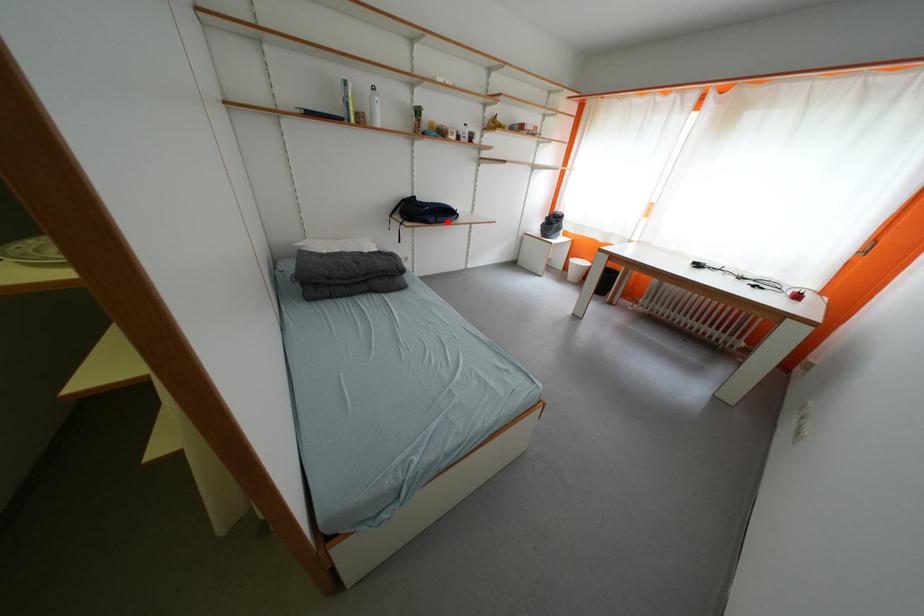
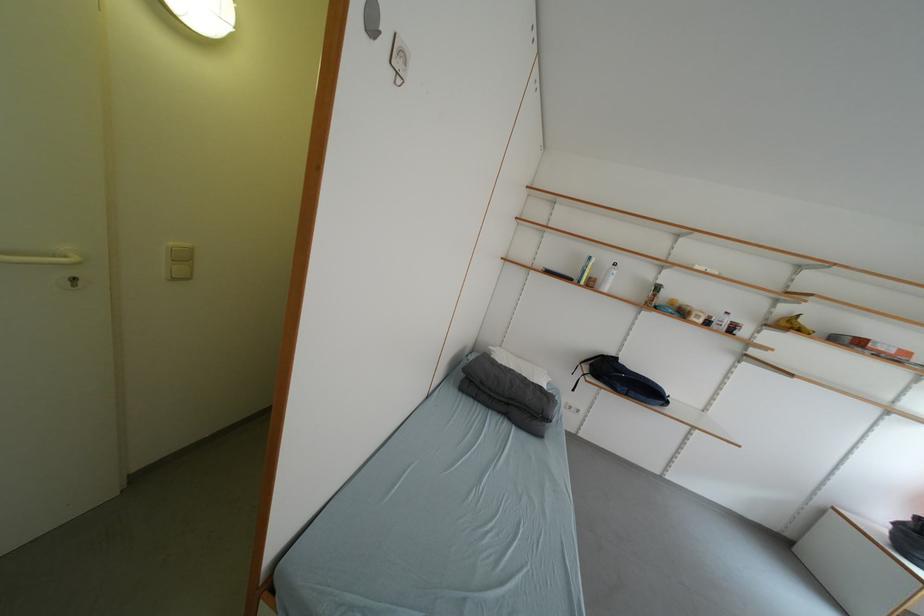
In the second image, find the point that corresponds to the highlighted location in the first image.

(640, 395)